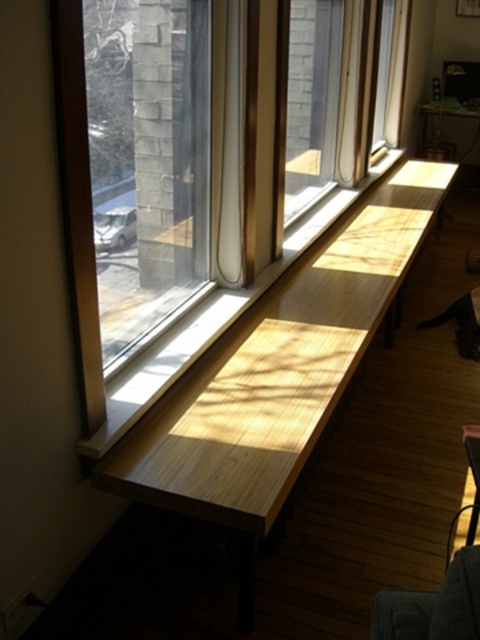
You are standing in the room depicted in the scene. There is a point marked at coordinates (x=276, y=374). What object is located at that point?

The natural wood bench at center is located at point (x=276, y=374).

You are sitting on the dark gray fabric armchair at lower right and want to look outside. Which direction should you turn your head to face the transparent glass window at center?

You should turn your head to the left because the transparent glass window at center is positioned on the left side of the dark gray fabric armchair at lower right.

You are a person who is 1.7 meters tall. You want to sit on the natural wood bench at center and then move to the dark gray fabric armchair at lower right. Which piece of furniture will you need to climb onto first?

The natural wood bench at center is much taller than the dark gray fabric armchair at lower right. Since the bench is taller, you will need to climb onto the natural wood bench at center first before moving to the lower armchair.